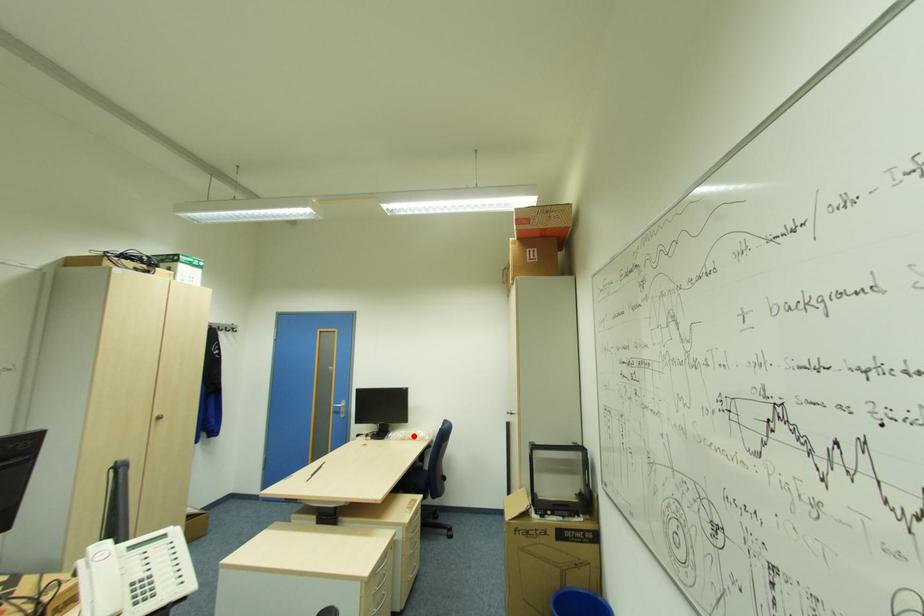
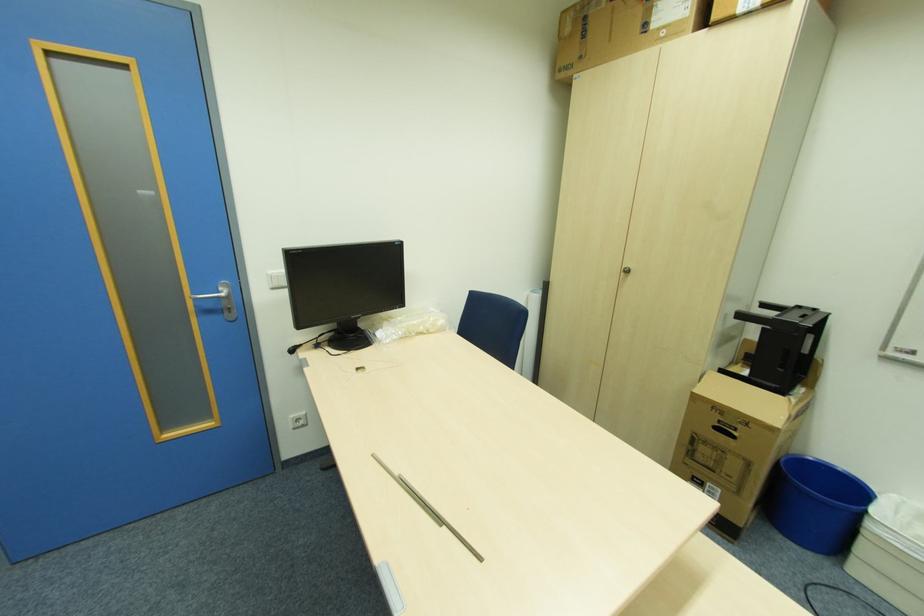
The point at the highlighted location is marked in the first image. Where is the corresponding point in the second image?

(424, 329)